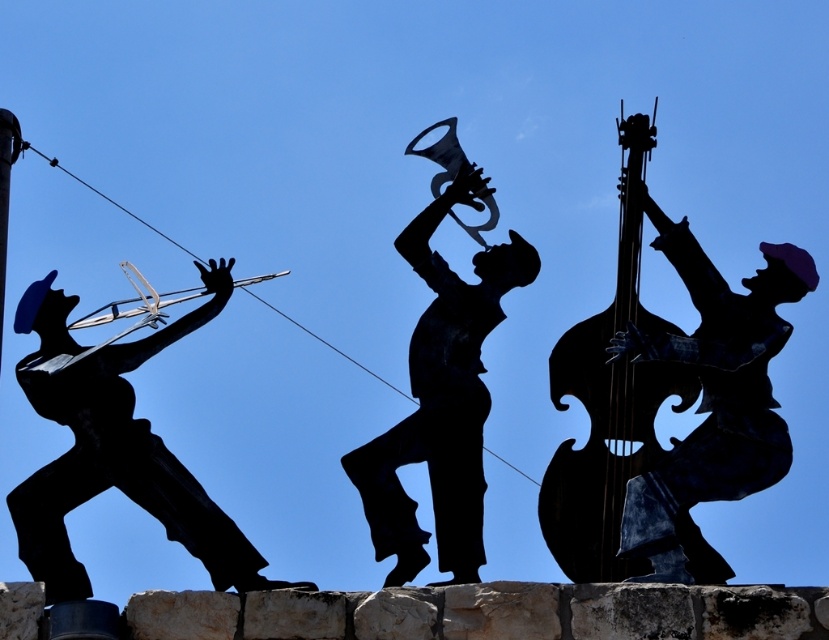
Question: Which point is closer to the camera?

Choices:
 (A) black matte violin at left
 (B) black metal trumpet at center

Answer: (A)

Question: Which object is the closest to the black matte violin at left?

Choices:
 (A) metallic dark brown cello at right
 (B) black matte bass at right

Answer: (A)

Question: Is black matte bass at right thinner than black metal trumpet at center?

Choices:
 (A) yes
 (B) no

Answer: (B)

Question: Is black matte bass at right above metallic dark brown cello at right?

Choices:
 (A) no
 (B) yes

Answer: (A)

Question: Is black matte bass at right above black matte violin at left?

Choices:
 (A) yes
 (B) no

Answer: (A)

Question: Which object appears closest to the camera in this image?

Choices:
 (A) black matte bass at right
 (B) metallic dark brown cello at right
 (C) black matte violin at left
 (D) black metal trumpet at center

Answer: (C)